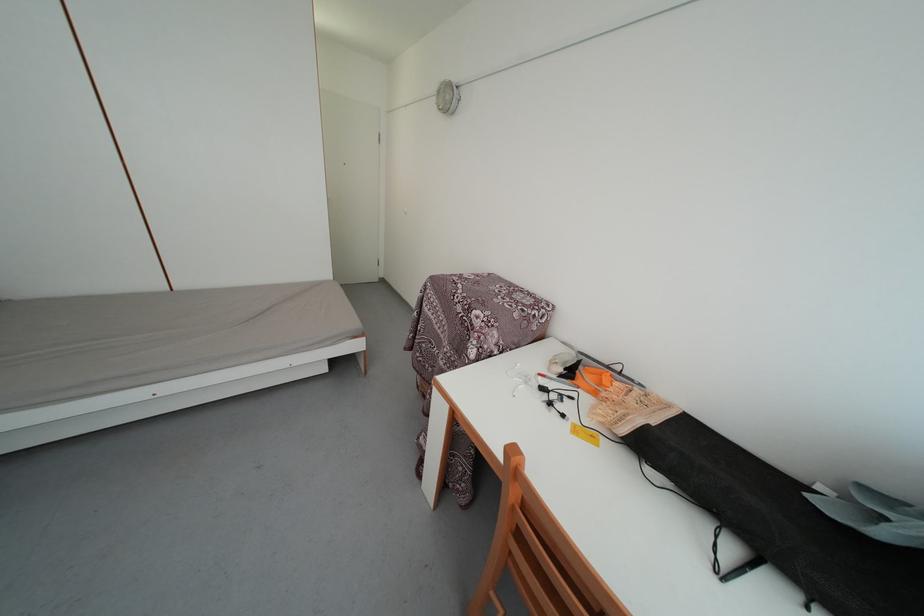
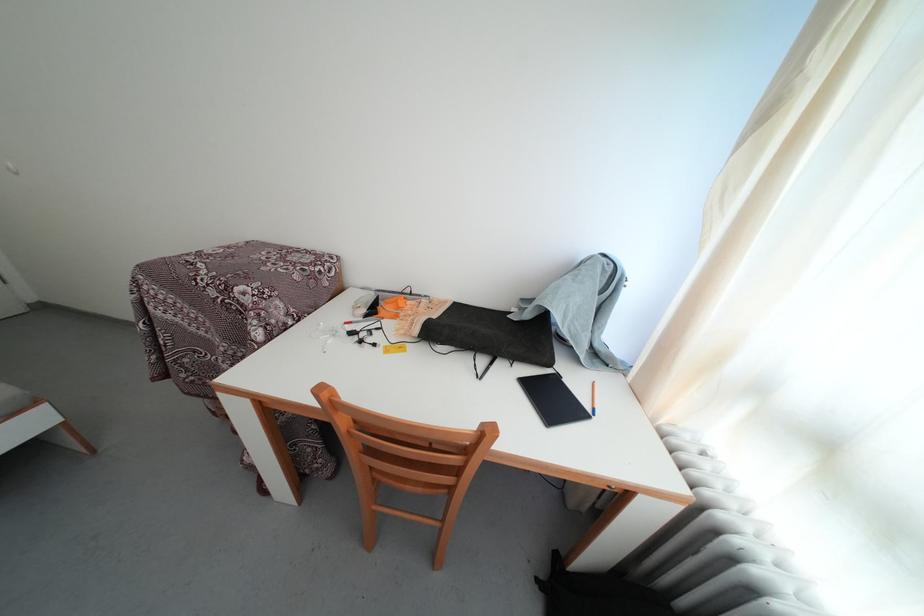
The point at (558, 368) is marked in the first image. Where is the corresponding point in the second image?

(361, 314)